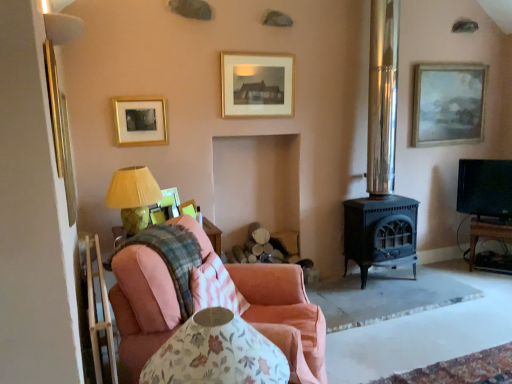
At what (x,y) coordinates should I click in order to perform the action: click on free space above matte gold picture frame at upper right, placed as the 5th picture frame when sorted from left to right (from a real-world perspective). Please return your answer as a coordinate pair (x, y). Image resolution: width=512 pixels, height=384 pixels. Looking at the image, I should click on (455, 60).